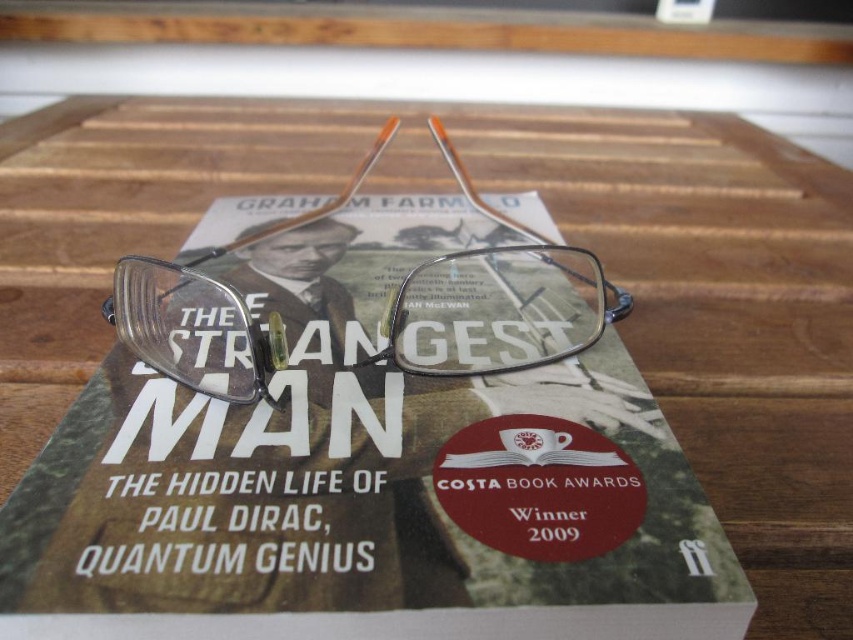
Who is more distant from viewer, [4,620] or [572,292]?

The point [572,292] is more distant.

Can you confirm if matte green book at center is smaller than clear plastic glasses at center?

Incorrect, matte green book at center is not smaller in size than clear plastic glasses at center.

At what (x,y) coordinates should I click in order to perform the action: click on matte green book at center. Please return your answer as a coordinate pair (x, y). Looking at the image, I should click on (367, 449).